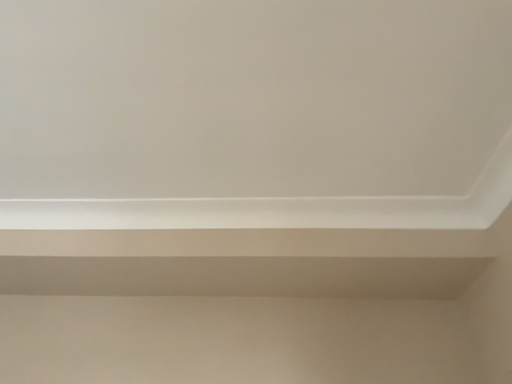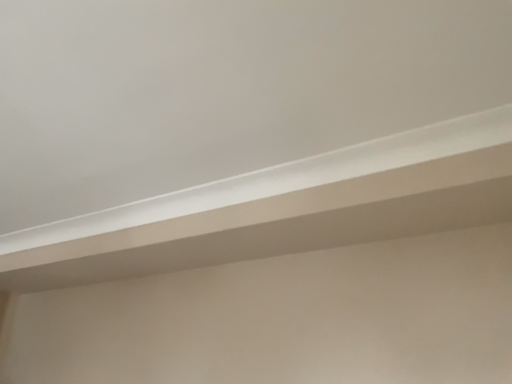
Question: How did the camera likely rotate when shooting the video?

Choices:
 (A) rotated left
 (B) rotated right

Answer: (A)